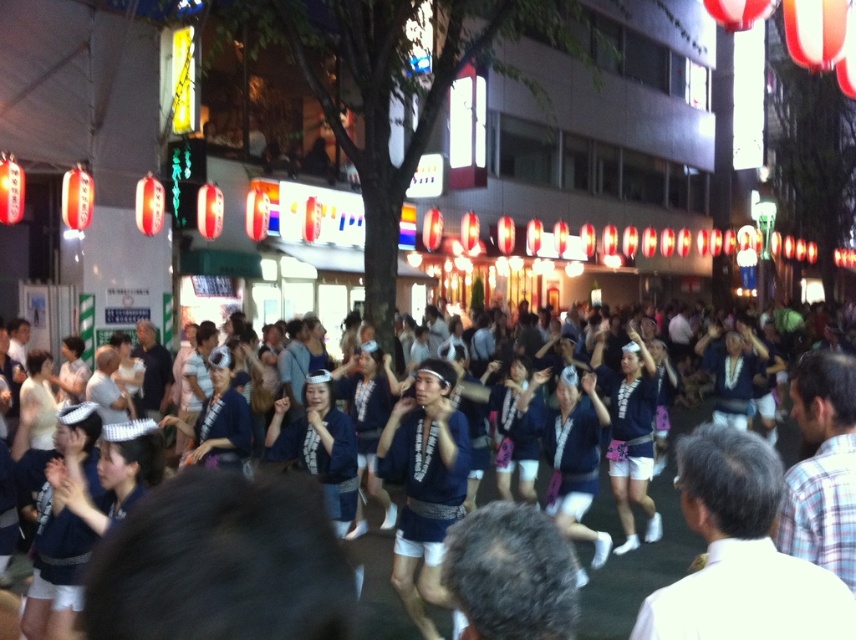
You are standing in the street scene and want to determine which of the two points, point (705, 429) or point (646, 472), is closer to you. Based on the scene, which point is nearer?

Point (705, 429) is closer to the viewer than point (646, 472).